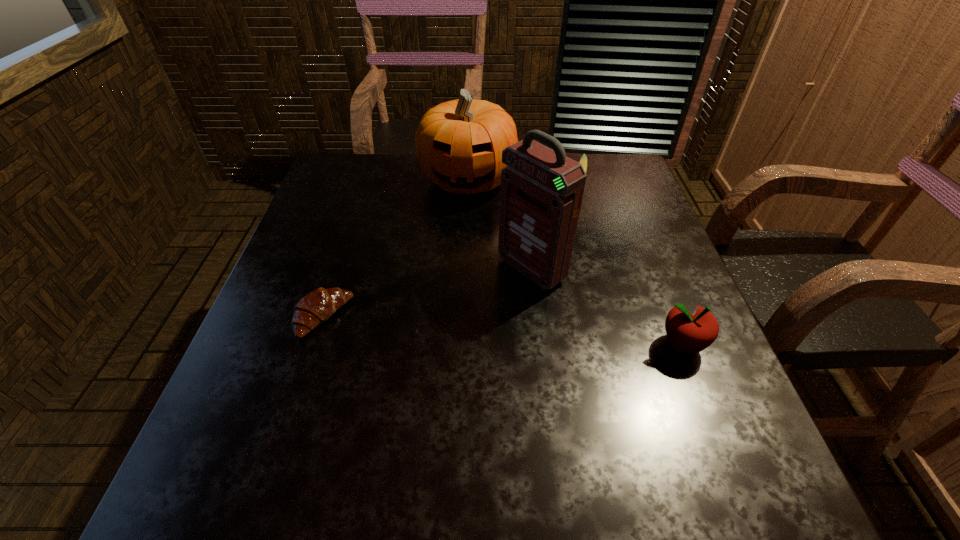
Image resolution: width=960 pixels, height=540 pixels. What are the coordinates of `pumpkin that is at the far edge` in the screenshot? It's located at (459, 143).

What are the coordinates of `banana positioned at the far edge` in the screenshot? It's located at (583, 160).

Locate an element on the screen. object that is at the left edge is located at coordinates (317, 306).

Where is `apple located in the right edge section of the desktop`? apple located in the right edge section of the desktop is located at coordinates (692, 333).

Identify the location of banana at the right edge. This screenshot has height=540, width=960. (583, 160).

What are the coordinates of `object that is at the far right corner` in the screenshot? It's located at (583, 160).

You are a GUI agent. You are given a task and a screenshot of the screen. Output one action in this format:
    pyautogui.click(x=<x>, y=<y>)
    Task: Click on the free space at the far edge
    Image resolution: width=960 pixels, height=540 pixels.
    Given the screenshot: What is the action you would take?
    pyautogui.click(x=401, y=172)

Where is `vacant space at the near edge`? Image resolution: width=960 pixels, height=540 pixels. vacant space at the near edge is located at coordinates (592, 411).

In the image, there is a desktop. In order to click on vacant space at the left edge in this screenshot , I will do `click(306, 223)`.

Find the location of a particular element. The width and height of the screenshot is (960, 540). free spot at the right edge of the desktop is located at coordinates (646, 265).